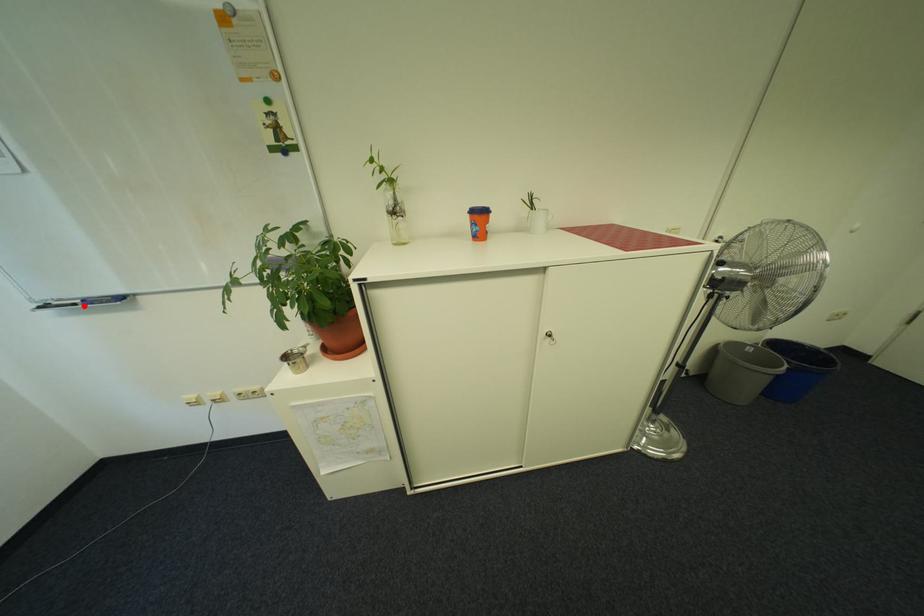
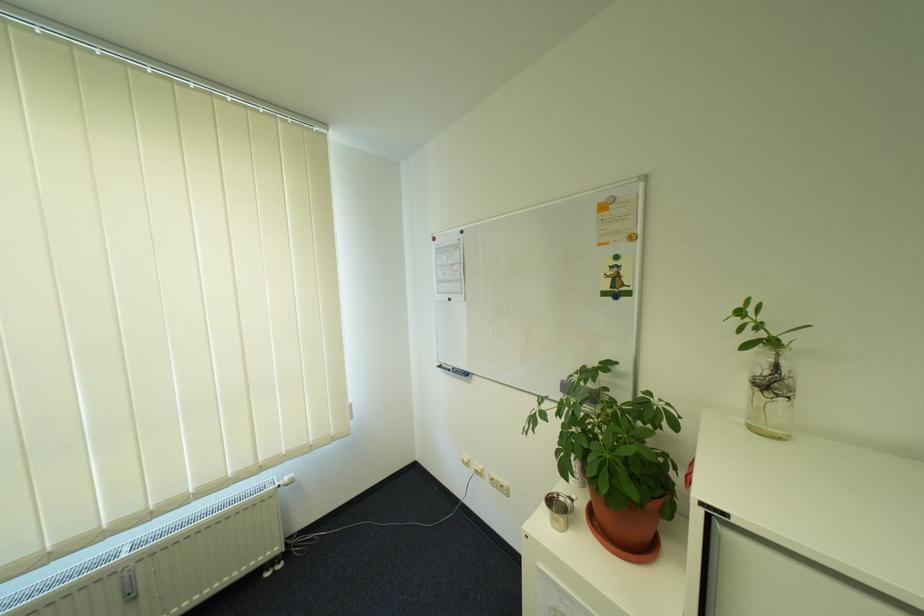
The point at the highlighted location is marked in the first image. Where is the corresponding point in the second image?

(458, 371)